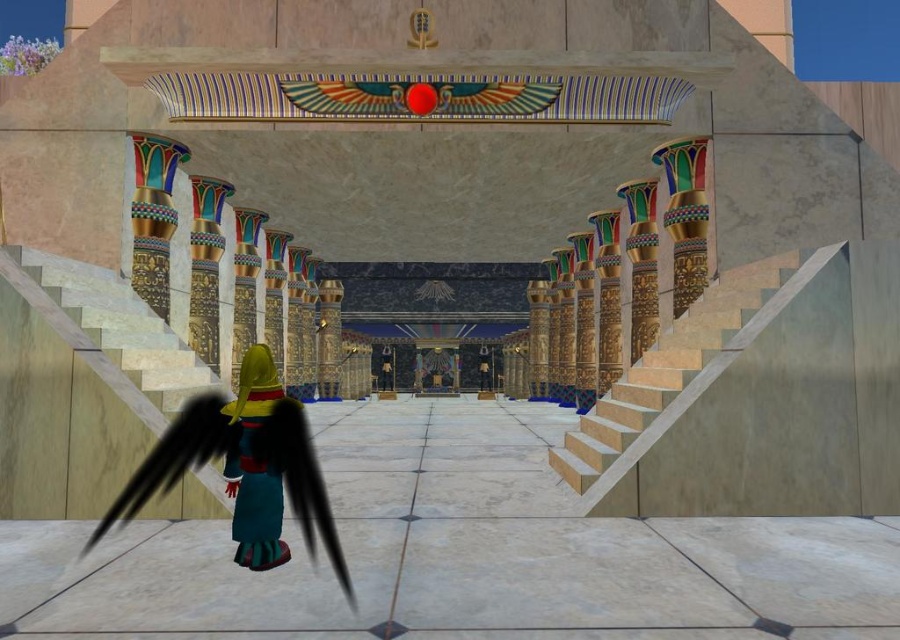
Can you confirm if marble stairs at lower left is wider than beige marble stairs at right?

No, marble stairs at lower left is not wider than beige marble stairs at right.

Based on the photo, is marble stairs at lower left taller than beige marble stairs at right?

In fact, marble stairs at lower left may be shorter than beige marble stairs at right.

What do you see at coordinates (61, 410) in the screenshot?
I see `marble stairs at lower left` at bounding box center [61, 410].

The width and height of the screenshot is (900, 640). I want to click on marble stairs at lower left, so click(x=61, y=410).

Which is below, beige marble stairs at right or velvet teal robe at lower left?

Positioned lower is velvet teal robe at lower left.

Does point (657, 406) lie behind point (244, 474)?

Yes, point (657, 406) is behind point (244, 474).

Identify the location of beige marble stairs at right. (667, 368).

Identify the location of marble stairs at lower left. Image resolution: width=900 pixels, height=640 pixels. (61, 410).

Can you confirm if marble stairs at lower left is thinner than velvet teal robe at lower left?

In fact, marble stairs at lower left might be wider than velvet teal robe at lower left.

Is point (57, 500) closer to camera compared to point (252, 412)?

No, (57, 500) is further to viewer.

At what (x,y) coordinates should I click in order to perform the action: click on marble stairs at lower left. Please return your answer as a coordinate pair (x, y). The height and width of the screenshot is (640, 900). Looking at the image, I should click on (61, 410).